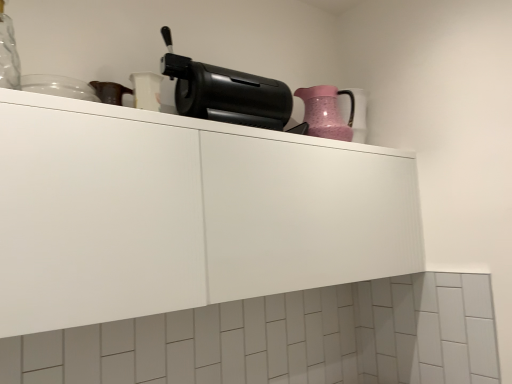
Question: From a real-world perspective, is pink textured pitcher at upper right physically above black plastic coffee maker at upper center?

Choices:
 (A) no
 (B) yes

Answer: (A)

Question: Is black plastic coffee maker at upper center at the back of pink textured pitcher at upper right?

Choices:
 (A) no
 (B) yes

Answer: (A)

Question: Is pink textured pitcher at upper right located outside black plastic coffee maker at upper center?

Choices:
 (A) yes
 (B) no

Answer: (A)

Question: Does pink textured pitcher at upper right turn towards black plastic coffee maker at upper center?

Choices:
 (A) no
 (B) yes

Answer: (A)

Question: Is the depth of pink textured pitcher at upper right greater than that of black plastic coffee maker at upper center?

Choices:
 (A) no
 (B) yes

Answer: (B)

Question: Is pink textured pitcher at upper right wider than black plastic coffee maker at upper center?

Choices:
 (A) yes
 (B) no

Answer: (A)

Question: Can black plastic coffee maker at upper center be found inside white matte cabinet at upper center?

Choices:
 (A) no
 (B) yes

Answer: (A)

Question: From a real-world perspective, is white matte cabinet at upper center below black plastic coffee maker at upper center?

Choices:
 (A) no
 (B) yes

Answer: (B)

Question: Is white matte cabinet at upper center far away from black plastic coffee maker at upper center?

Choices:
 (A) no
 (B) yes

Answer: (A)

Question: From the image's perspective, is white matte cabinet at upper center under black plastic coffee maker at upper center?

Choices:
 (A) yes
 (B) no

Answer: (A)

Question: From a real-world perspective, does white matte cabinet at upper center stand above black plastic coffee maker at upper center?

Choices:
 (A) yes
 (B) no

Answer: (B)

Question: Is white matte cabinet at upper center oriented away from black plastic coffee maker at upper center?

Choices:
 (A) no
 (B) yes

Answer: (A)

Question: Can you confirm if black plastic coffee maker at upper center is positioned to the right of white matte cabinet at upper center?

Choices:
 (A) no
 (B) yes

Answer: (A)